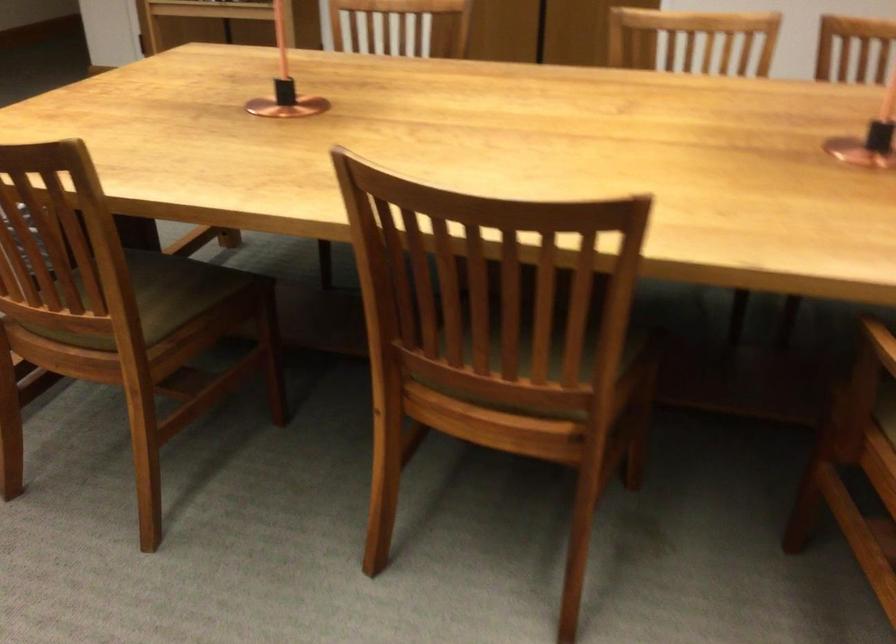
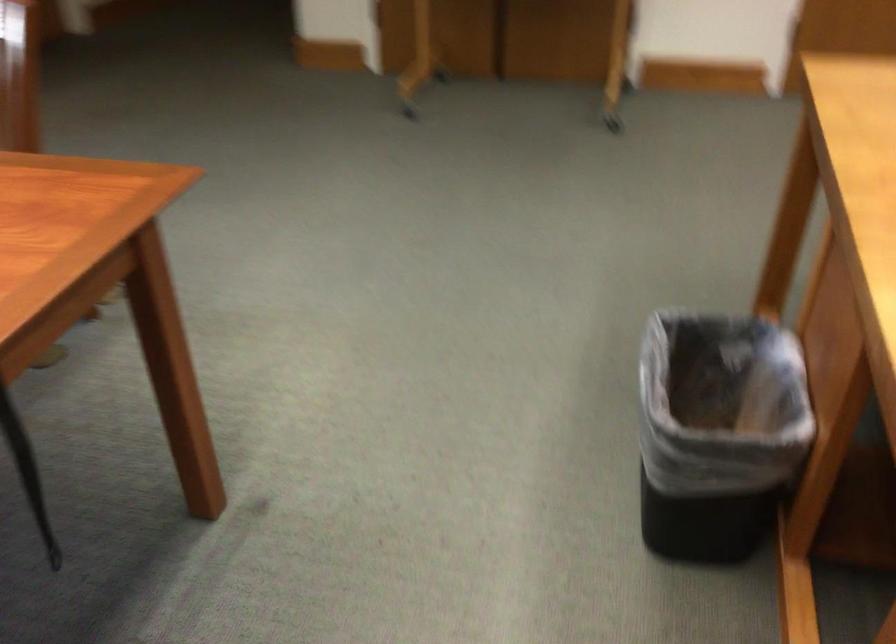
What movement of the cameraman would produce the second image?

The cameraman moved toward left, forward.